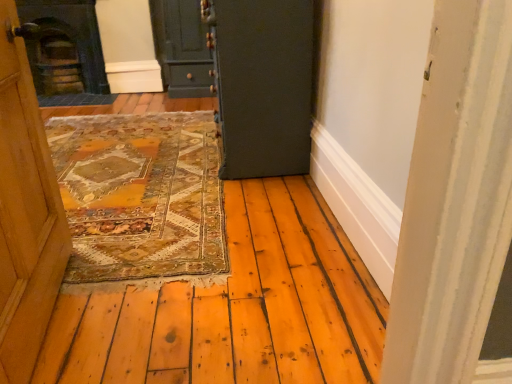
Question: From the image's perspective, does dark gray stone fireplace at upper left appear lower than dark green wood at center, acting as the first door starting from the front?

Choices:
 (A) no
 (B) yes

Answer: (A)

Question: Does dark gray stone fireplace at upper left have a smaller size compared to dark green wood at center, acting as the first door starting from the front?

Choices:
 (A) no
 (B) yes

Answer: (B)

Question: Is dark green wood at center, acting as the first door starting from the front, completely or partially inside dark gray stone fireplace at upper left?

Choices:
 (A) no
 (B) yes

Answer: (A)

Question: Is dark gray stone fireplace at upper left facing away from dark green wood at center, the second door from the back?

Choices:
 (A) yes
 (B) no

Answer: (B)

Question: Is dark gray stone fireplace at upper left wider than dark green wood at center, the second door from the back?

Choices:
 (A) yes
 (B) no

Answer: (B)

Question: From the image's perspective, is matte dark green cabinet at upper center, which ranks as the 1th door in left-to-right order, located above or below dark gray stone fireplace at upper left?

Choices:
 (A) below
 (B) above

Answer: (B)

Question: Choose the correct answer: Is matte dark green cabinet at upper center, which is the second door in front-to-back order, inside dark gray stone fireplace at upper left or outside it?

Choices:
 (A) inside
 (B) outside

Answer: (B)

Question: Based on their positions, is matte dark green cabinet at upper center, placed as the second door when sorted from right to left, located to the left or right of dark gray stone fireplace at upper left?

Choices:
 (A) left
 (B) right

Answer: (B)

Question: Considering the positions of matte dark green cabinet at upper center, which is the second door in front-to-back order, and dark gray stone fireplace at upper left in the image, is matte dark green cabinet at upper center, which is the second door in front-to-back order, wider or thinner than dark gray stone fireplace at upper left?

Choices:
 (A) thin
 (B) wide

Answer: (B)

Question: In terms of size, does dark gray stone fireplace at upper left appear bigger or smaller than matte dark green cabinet at upper center, acting as the 1th door starting from the back?

Choices:
 (A) big
 (B) small

Answer: (A)

Question: From a real-world perspective, is dark gray stone fireplace at upper left physically located above or below matte dark green cabinet at upper center, which is the second door in front-to-back order?

Choices:
 (A) above
 (B) below

Answer: (A)

Question: From the image's perspective, is dark gray stone fireplace at upper left above or below matte dark green cabinet at upper center, placed as the second door when sorted from right to left?

Choices:
 (A) below
 (B) above

Answer: (A)

Question: Relative to matte dark green cabinet at upper center, which is the second door in front-to-back order, is dark gray stone fireplace at upper left in front or behind?

Choices:
 (A) front
 (B) behind

Answer: (B)

Question: Do you think dark green wood at center, acting as the first door starting from the front, is within dark gray stone fireplace at upper left, or outside of it?

Choices:
 (A) inside
 (B) outside

Answer: (B)

Question: From the image's perspective, is dark green wood at center, the second door from the back, above or below dark gray stone fireplace at upper left?

Choices:
 (A) above
 (B) below

Answer: (B)